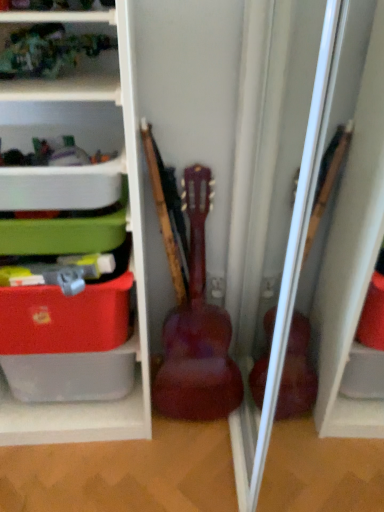
The image size is (384, 512). Describe the element at coordinates (96, 207) in the screenshot. I see `matte plastic storage at left, the 1th shelf positioned from the bottom` at that location.

What is the approximate height of glossy wood guitar at center?

It is 28.60 inches.

Locate an element on the screen. The image size is (384, 512). glossy wood guitar at center is located at coordinates (197, 331).

Image resolution: width=384 pixels, height=512 pixels. What are the coordinates of `white plastic container at upper left, the first shelf from the top` in the screenshot? It's located at (61, 167).

From a real-world perspective, is glossy wood guitar at center on white plastic container at upper left, the first shelf from the top?

No, from a real-world perspective, glossy wood guitar at center is not over white plastic container at upper left, the first shelf from the top

How different are the orientations of glossy wood guitar at center and white plastic container at upper left, the first shelf from the top, in degrees?

0.0604 degrees.

Does glossy wood guitar at center touch white plastic container at upper left, the first shelf from the top?

glossy wood guitar at center is not next to white plastic container at upper left, the first shelf from the top, and they're not touching.

Between glossy wood guitar at center and white plastic container at upper left, the 2th shelf ordered from the bottom, which one is positioned in front?

white plastic container at upper left, the 2th shelf ordered from the bottom.

Considering the relative sizes of glossy wood guitar at center and matte plastic storage box at left in the image provided, is glossy wood guitar at center taller than matte plastic storage box at left?

Yes.

Find the location of a particular element. storage box on the left of glossy wood guitar at center is located at coordinates (65, 318).

How much distance is there between glossy wood guitar at center and matte plastic storage box at left?

The distance of glossy wood guitar at center from matte plastic storage box at left is 13.04 inches.

Between glossy wood guitar at center and matte plastic storage box at left, which one has smaller size?

With smaller size is matte plastic storage box at left.

From a real-world perspective, is matte plastic storage at left, marked as the 2th shelf in a top-to-bottom arrangement, physically above white plastic container at upper left, the first shelf from the top?

No, from a real-world perspective, matte plastic storage at left, marked as the 2th shelf in a top-to-bottom arrangement, is not above white plastic container at upper left, the first shelf from the top.

Is matte plastic storage at left, marked as the 2th shelf in a top-to-bottom arrangement, taller than white plastic container at upper left, the first shelf from the top?

Yes.

In order to click on shelf that is under the white plastic container at upper left, the 2th shelf ordered from the bottom (from a real-world perspective) in this screenshot , I will do `click(96, 207)`.

Can you confirm if matte plastic storage box at left is thinner than matte plastic storage at left, marked as the 2th shelf in a top-to-bottom arrangement?

Yes, matte plastic storage box at left is thinner than matte plastic storage at left, marked as the 2th shelf in a top-to-bottom arrangement.

Based on the photo, measure the distance from matte plastic storage box at left to matte plastic storage at left, the 1th shelf positioned from the bottom.

A distance of 8.27 inches exists between matte plastic storage box at left and matte plastic storage at left, the 1th shelf positioned from the bottom.

Considering the relative positions of matte plastic storage box at left and matte plastic storage at left, the 1th shelf positioned from the bottom, in the image provided, is matte plastic storage box at left to the right of matte plastic storage at left, the 1th shelf positioned from the bottom, from the viewer's perspective?

Correct, you'll find matte plastic storage box at left to the right of matte plastic storage at left, the 1th shelf positioned from the bottom.

Is matte plastic storage box at left positioned far away from matte plastic storage at left, marked as the 2th shelf in a top-to-bottom arrangement?

They are positioned close to each other.

Is matte plastic storage box at left located within matte plastic storage at left, marked as the 2th shelf in a top-to-bottom arrangement?

Yes, matte plastic storage at left, marked as the 2th shelf in a top-to-bottom arrangement, contains matte plastic storage box at left.

What's the angular difference between matte plastic storage at left, marked as the 2th shelf in a top-to-bottom arrangement, and matte plastic storage box at left's facing directions?

0.00517 degrees.

Does matte plastic storage at left, the 1th shelf positioned from the bottom, turn towards matte plastic storage box at left?

Yes, matte plastic storage at left, the 1th shelf positioned from the bottom, is aimed at matte plastic storage box at left.

This screenshot has width=384, height=512. Find the location of `storage box that appears below the matte plastic storage at left, marked as the 2th shelf in a top-to-bottom arrangement (from the image's perspective)`. storage box that appears below the matte plastic storage at left, marked as the 2th shelf in a top-to-bottom arrangement (from the image's perspective) is located at coordinates (65, 318).

Which is behind, point (121, 282) or point (194, 352)?

The point (194, 352) is more distant.

Considering the relative positions of matte plastic storage box at left and glossy wood guitar at center in the image provided, is matte plastic storage box at left to the left of glossy wood guitar at center from the viewer's perspective?

Indeed, matte plastic storage box at left is positioned on the left side of glossy wood guitar at center.

Can you confirm if matte plastic storage box at left is smaller than glossy wood guitar at center?

Yes, matte plastic storage box at left is smaller than glossy wood guitar at center.

Considering the sizes of objects white plastic container at upper left, the first shelf from the top, and glossy wood guitar at center in the image provided, who is wider, white plastic container at upper left, the first shelf from the top, or glossy wood guitar at center?

Wider between the two is white plastic container at upper left, the first shelf from the top.

The image size is (384, 512). In order to click on the 1st shelf in front of the glossy wood guitar at center in this screenshot , I will do `click(61, 167)`.

Are white plastic container at upper left, the 2th shelf ordered from the bottom, and glossy wood guitar at center located far from each other?

That's not correct — white plastic container at upper left, the 2th shelf ordered from the bottom, is a little close to glossy wood guitar at center.

From the picture: Which object is closer to the camera, white plastic container at upper left, the first shelf from the top, or glossy wood guitar at center?

white plastic container at upper left, the first shelf from the top.

Locate an element on the screen. The height and width of the screenshot is (512, 384). guitar located underneath the white plastic container at upper left, the first shelf from the top (from a real-world perspective) is located at coordinates (197, 331).

Where is `storage box above the glossy wood guitar at center (from the image's perspective)`? This screenshot has height=512, width=384. storage box above the glossy wood guitar at center (from the image's perspective) is located at coordinates pyautogui.click(x=65, y=318).

From the image, which object appears to be nearer to white plastic container at upper left, the first shelf from the top, glossy wood guitar at center or matte plastic storage box at left?

matte plastic storage box at left is positioned closer to the anchor white plastic container at upper left, the first shelf from the top.

When comparing their distances from white plastic container at upper left, the first shelf from the top, does matte plastic storage at left, the 1th shelf positioned from the bottom, or matte plastic storage box at left seem further?

matte plastic storage box at left lies further to white plastic container at upper left, the first shelf from the top, than the other object.

From the image, which object appears to be farther from matte plastic storage box at left, matte plastic storage at left, the 1th shelf positioned from the bottom, or glossy wood guitar at center?

Based on the image, glossy wood guitar at center appears to be further to matte plastic storage box at left.

Estimate the real-world distances between objects in this image. Which object is closer to white plastic container at upper left, the first shelf from the top, matte plastic storage box at left or matte plastic storage at left, the 1th shelf positioned from the bottom?

matte plastic storage at left, the 1th shelf positioned from the bottom.

Looking at the image, which one is located further to matte plastic storage box at left, white plastic container at upper left, the first shelf from the top, or matte plastic storage at left, marked as the 2th shelf in a top-to-bottom arrangement?

Based on the image, white plastic container at upper left, the first shelf from the top, appears to be further to matte plastic storage box at left.

Which object lies further to the anchor point matte plastic storage at left, marked as the 2th shelf in a top-to-bottom arrangement, glossy wood guitar at center or white plastic container at upper left, the 2th shelf ordered from the bottom?

glossy wood guitar at center lies further to matte plastic storage at left, marked as the 2th shelf in a top-to-bottom arrangement, than the other object.

Looking at the image, which one is located closer to matte plastic storage box at left, matte plastic storage at left, marked as the 2th shelf in a top-to-bottom arrangement, or white plastic container at upper left, the first shelf from the top?

The object closer to matte plastic storage box at left is matte plastic storage at left, marked as the 2th shelf in a top-to-bottom arrangement.

Considering their positions, is glossy wood guitar at center positioned further to matte plastic storage box at left than matte plastic storage at left, marked as the 2th shelf in a top-to-bottom arrangement?

Among the two, glossy wood guitar at center is located further to matte plastic storage box at left.

Where is `shelf between white plastic container at upper left, the 2th shelf ordered from the bottom, and matte plastic storage box at left, in the vertical direction`? This screenshot has height=512, width=384. shelf between white plastic container at upper left, the 2th shelf ordered from the bottom, and matte plastic storage box at left, in the vertical direction is located at coordinates (96, 207).

You are a GUI agent. You are given a task and a screenshot of the screen. Output one action in this format:
    pyautogui.click(x=<x>, y=<y>)
    Task: Click on the shelf located between matte plastic storage box at left and glossy wood guitar at center in the left-right direction
    
    Given the screenshot: What is the action you would take?
    pyautogui.click(x=61, y=167)

Locate an element on the screen. The image size is (384, 512). shelf between matte plastic storage at left, the 1th shelf positioned from the bottom, and glossy wood guitar at center, in the horizontal direction is located at coordinates (61, 167).

Find the location of a particular element. storage box between matte plastic storage at left, marked as the 2th shelf in a top-to-bottom arrangement, and glossy wood guitar at center from left to right is located at coordinates (65, 318).